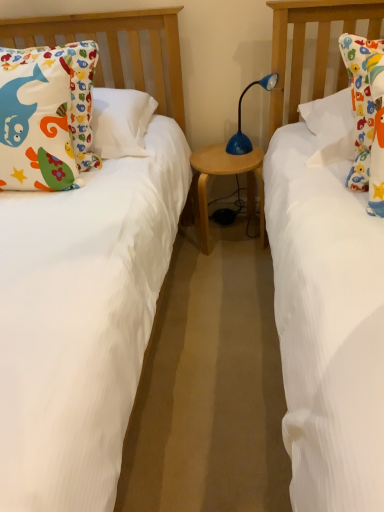
Question: Based on their positions, is wooden table at center located to the left or right of blue plastic table lamp at center?

Choices:
 (A) right
 (B) left

Answer: (B)

Question: Does point (193, 156) appear closer or farther from the camera than point (266, 74)?

Choices:
 (A) farther
 (B) closer

Answer: (A)

Question: Which is nearer to the wooden table at center?

Choices:
 (A) blue plastic table lamp at center
 (B) matte cotton pillow at left

Answer: (A)

Question: Estimate the real-world distances between objects in this image. Which object is closer to the wooden table at center?

Choices:
 (A) matte cotton pillow at left
 (B) blue plastic table lamp at center

Answer: (B)